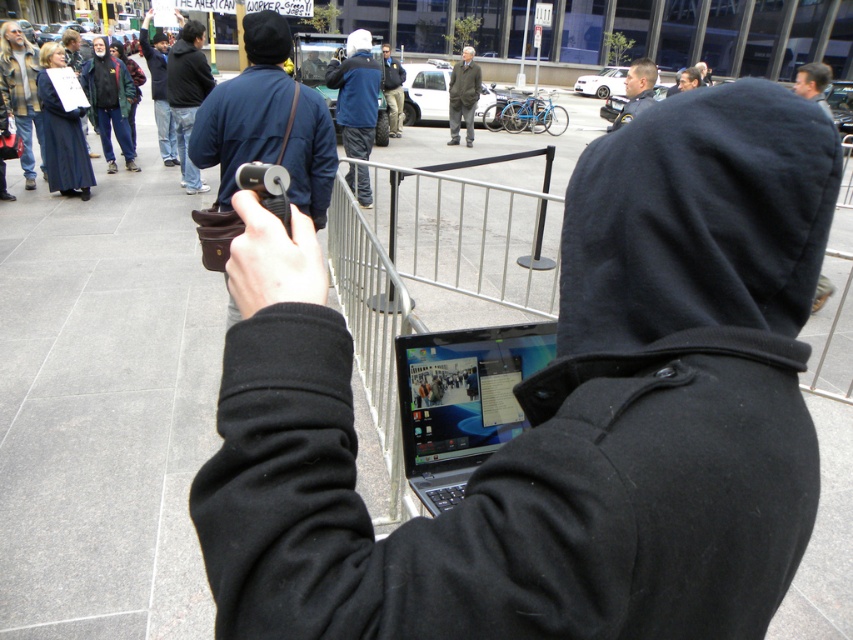
Question: Which point is farther from the camera taking this photo?

Choices:
 (A) (466, 61)
 (B) (178, 19)
 (C) (634, 77)
 (D) (839, 180)

Answer: (A)

Question: Which point is closer to the camera?

Choices:
 (A) (625, 81)
 (B) (451, 109)

Answer: (A)

Question: Is dark blue hoodie at center bigger than gray wool coat at center?

Choices:
 (A) no
 (B) yes

Answer: (B)

Question: Is black fleece hoodie at center further to camera compared to light brown uniform at center?

Choices:
 (A) yes
 (B) no

Answer: (B)

Question: Is dark blue hoodie at upper center bigger than gray wool coat at center?

Choices:
 (A) no
 (B) yes

Answer: (A)

Question: Which point is closer to the camera taking this photo?

Choices:
 (A) (190, 24)
 (B) (225, 369)
 (C) (625, 90)
 (D) (473, 93)

Answer: (B)